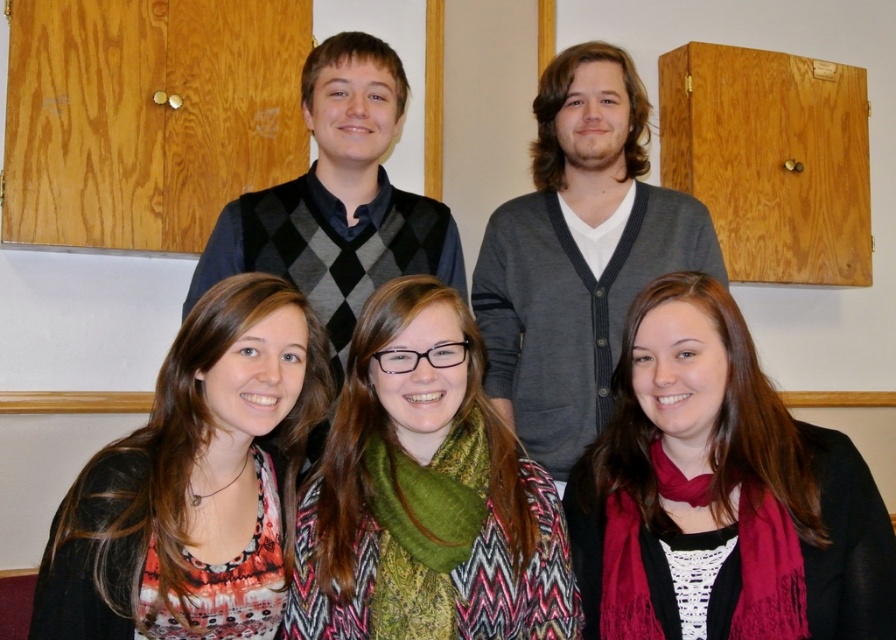
Between point (695, 374) and point (446, 547), which one is positioned in front?

Point (446, 547) is more forward.

Is matte black jacket at lower right below green knitted scarf at center?

Indeed, matte black jacket at lower right is positioned under green knitted scarf at center.

Who is more forward, (869, 476) or (346, 545)?

Point (346, 545) is more forward.

At what (x,y) coordinates should I click in order to perform the action: click on matte black jacket at lower right. Please return your answer as a coordinate pair (x, y). The height and width of the screenshot is (640, 896). Looking at the image, I should click on (721, 490).

What do you see at coordinates (195, 481) in the screenshot? This screenshot has height=640, width=896. I see `matte black shirt at lower left` at bounding box center [195, 481].

Does matte black shirt at lower left appear on the right side of green knitted scarf at center?

In fact, matte black shirt at lower left is to the left of green knitted scarf at center.

Which is behind, point (145, 508) or point (445, 538)?

The point (445, 538) is more distant.

Identify the location of matte black shirt at lower left. (195, 481).

Is matte black jacket at lower right taller than matte black shirt at lower left?

Yes, matte black jacket at lower right is taller than matte black shirt at lower left.

Who is lower down, matte black jacket at lower right or matte black shirt at lower left?

matte black shirt at lower left

Does point (651, 525) come closer to viewer compared to point (229, 349)?

That is False.

This screenshot has height=640, width=896. In order to click on matte black jacket at lower right in this screenshot , I will do `click(721, 490)`.